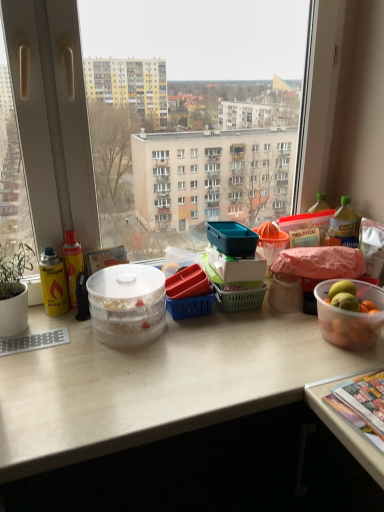
Question: From a real-world perspective, relative to clear plastic bottle at right, is white matte desk at center vertically above or below?

Choices:
 (A) above
 (B) below

Answer: (B)

Question: Is white matte desk at center spatially inside clear plastic bottle at right, or outside of it?

Choices:
 (A) inside
 (B) outside

Answer: (B)

Question: Which object is the closest to the translucent plastic bowl at right, which appears as the first bowl when viewed from the right?

Choices:
 (A) multicolored glossy magazine at lower right
 (B) clear plastic bottle at right
 (C) transparent glass window at center
 (D) transparent plastic bowl at center, the second bowl from the right
 (E) white matte desk at center

Answer: (A)

Question: Which object is positioned farthest from the clear plastic bottle at right?

Choices:
 (A) translucent plastic bowl at right, acting as the 2th bowl starting from the left
 (B) multicolored glossy magazine at lower right
 (C) white matte desk at center
 (D) transparent plastic bowl at center, the second bowl from the right
 (E) transparent glass window at center

Answer: (E)